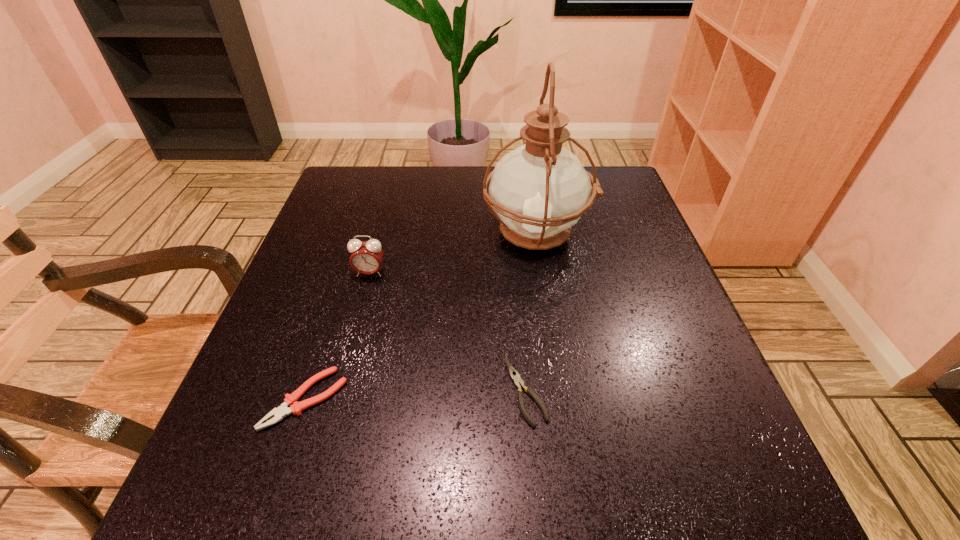
Choose which object is the nearest neighbor to the third shortest object. Please provide its 2D coordinates. Your answer should be formatted as a tuple, i.e. [(x, y)], where the tuple contains the x and y coordinates of a point satisfying the conditions above.

[(539, 190)]

Locate an element on the screen. free space that satisfies the following two spatial constraints: 1. on the clock face of the right pliers; 2. on the right side of the alarm clock is located at coordinates (338, 392).

At what (x,y) coordinates should I click in order to perform the action: click on free location that satisfies the following two spatial constraints: 1. on the back side of the oil lamp; 2. on the right side of the right pliers. Please return your answer as a coordinate pair (x, y). Looking at the image, I should click on (512, 234).

Where is `free space that satisfies the following two spatial constraints: 1. on the clock face of the right pliers; 2. on the left side of the second tallest object`? The height and width of the screenshot is (540, 960). free space that satisfies the following two spatial constraints: 1. on the clock face of the right pliers; 2. on the left side of the second tallest object is located at coordinates (338, 392).